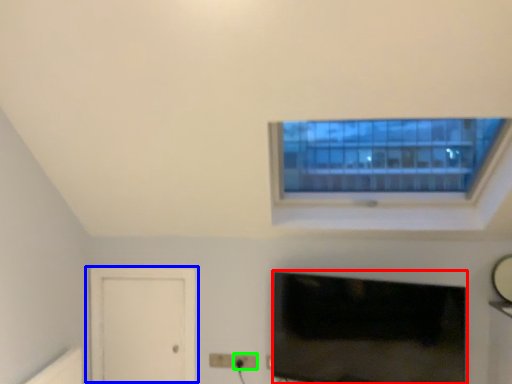
Question: Based on their relative distances, which object is nearer to television (highlighted by a red box)? Choose from door (highlighted by a blue box) and electric outlet (highlighted by a green box).

Choices:
 (A) door
 (B) electric outlet

Answer: (B)